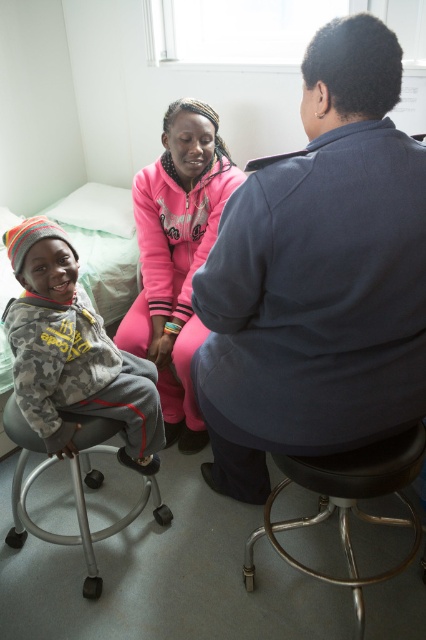
Question: Which of the following is the closest to the observer?

Choices:
 (A) (281, 394)
 (B) (409, 456)

Answer: (A)

Question: In this image, where is camouflage sweatshirt at left located relative to black metal bar stool at lower center?

Choices:
 (A) below
 (B) above

Answer: (B)

Question: Among these points, which one is farthest from the camera?

Choices:
 (A) (411, 387)
 (B) (23, 454)

Answer: (B)

Question: Considering the real-world distances, which object is closest to the pink fleece jacket at center?

Choices:
 (A) black metal bar stool at lower center
 (B) metallic silver bar stool at left
 (C) camouflage sweatshirt at left
 (D) dark blue uniform at center

Answer: (C)

Question: In this image, where is dark blue uniform at center located relative to metallic silver bar stool at left?

Choices:
 (A) left
 (B) right

Answer: (B)

Question: Does pink fleece jacket at center appear on the right side of metallic silver bar stool at left?

Choices:
 (A) yes
 (B) no

Answer: (A)